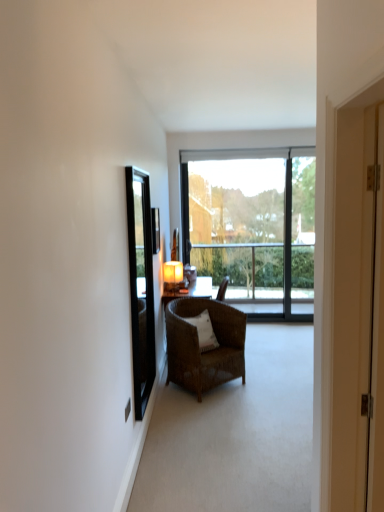
Question: Should I look upward or downward to see white wooden door at right?

Choices:
 (A) down
 (B) up

Answer: (A)

Question: Is clear glass mirror at left positioned behind white wooden door at right?

Choices:
 (A) yes
 (B) no

Answer: (A)

Question: Is clear glass mirror at left to the left of white wooden door at right from the viewer's perspective?

Choices:
 (A) no
 (B) yes

Answer: (B)

Question: Considering the relative positions of clear glass mirror at left and white wooden door at right in the image provided, is clear glass mirror at left in front of white wooden door at right?

Choices:
 (A) yes
 (B) no

Answer: (B)

Question: Is clear glass mirror at left completely or partially outside of white wooden door at right?

Choices:
 (A) no
 (B) yes

Answer: (B)

Question: Is clear glass mirror at left turned away from white wooden door at right?

Choices:
 (A) no
 (B) yes

Answer: (A)

Question: Considering the relative sizes of clear glass mirror at left and white wooden door at right in the image provided, is clear glass mirror at left shorter than white wooden door at right?

Choices:
 (A) yes
 (B) no

Answer: (B)

Question: From the image's perspective, is white wooden door at right on transparent glass window at center?

Choices:
 (A) no
 (B) yes

Answer: (A)

Question: From the image's perspective, is white wooden door at right under transparent glass window at center?

Choices:
 (A) yes
 (B) no

Answer: (A)

Question: Can you confirm if white wooden door at right is wider than transparent glass window at center?

Choices:
 (A) yes
 (B) no

Answer: (A)

Question: Is white wooden door at right facing towards transparent glass window at center?

Choices:
 (A) no
 (B) yes

Answer: (A)

Question: From a real-world perspective, is white wooden door at right on top of transparent glass window at center?

Choices:
 (A) yes
 (B) no

Answer: (A)

Question: Can you confirm if white wooden door at right is taller than transparent glass window at center?

Choices:
 (A) yes
 (B) no

Answer: (B)

Question: Is white wooden door at right further to the viewer compared to clear glass mirror at left?

Choices:
 (A) yes
 (B) no

Answer: (B)